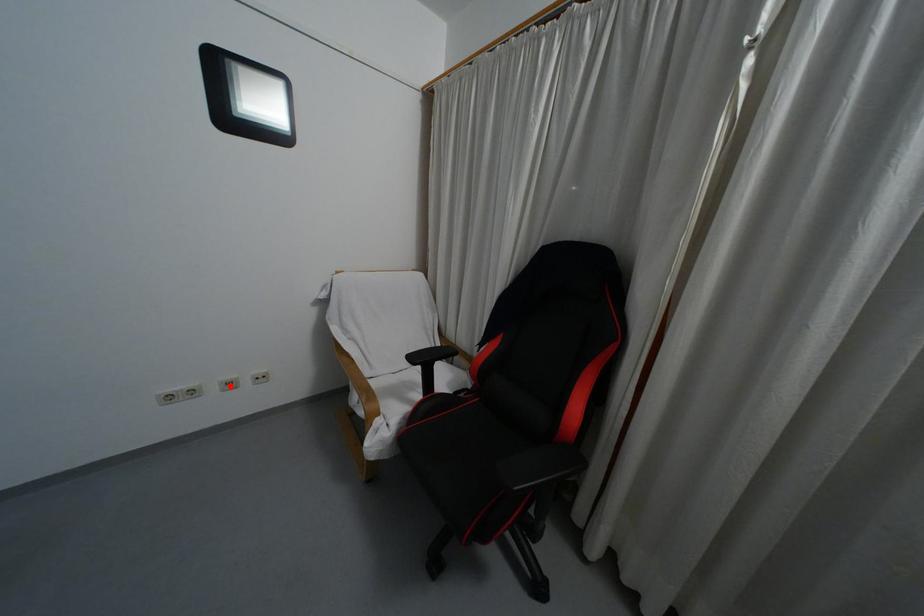
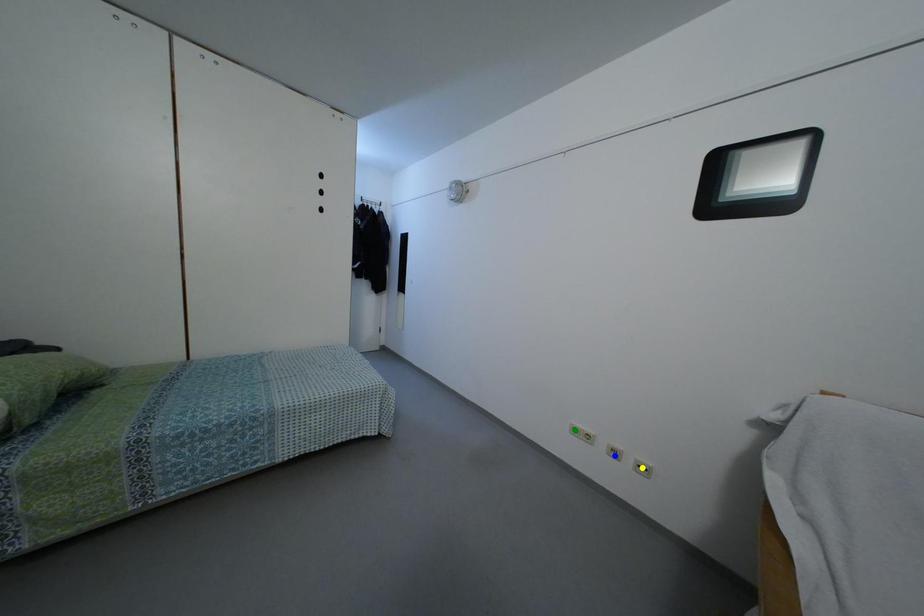
Question: I am providing you with two images of the same scene from different viewpoints. A red point is marked on the first image. You are given multiple points on the second image. Which spot in image 2 lines up with the point in image 1?

Choices:
 (A) yellow point
 (B) green point
 (C) blue point

Answer: (C)